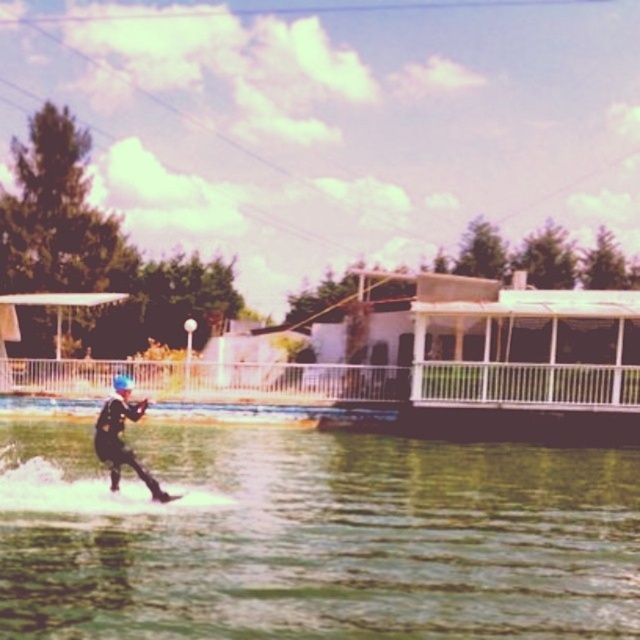
At what (x,y) coordinates should I click in order to perform the action: click on greenish water at lower center. Please return your answer as a coordinate pair (x, y). The height and width of the screenshot is (640, 640). Looking at the image, I should click on (314, 536).

Is point (218, 522) more distant than point (138, 413)?

Yes, point (218, 522) is behind point (138, 413).

Locate an element on the screen. The width and height of the screenshot is (640, 640). greenish water at lower center is located at coordinates (314, 536).